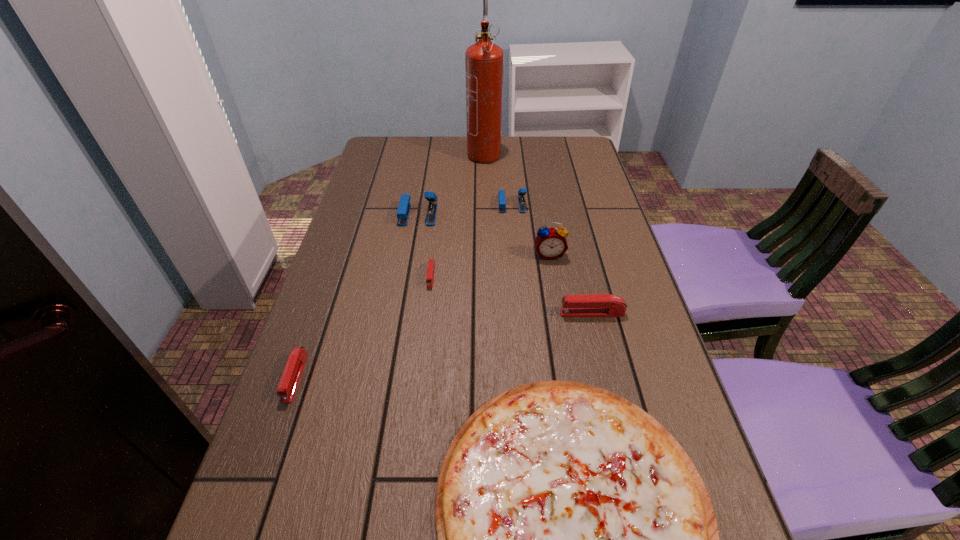
Locate an element on the screen. the sixth tallest object is located at coordinates pos(294,367).

Where is `the leftmost red stapler`? The height and width of the screenshot is (540, 960). the leftmost red stapler is located at coordinates (294, 367).

Where is `the smallest red stapler`? The width and height of the screenshot is (960, 540). the smallest red stapler is located at coordinates (431, 263).

Locate an element on the screen. The height and width of the screenshot is (540, 960). the second red stapler from right to left is located at coordinates (431, 263).

At what (x,y) coordinates should I click in order to perform the action: click on free space located 0.060m from the nozzle of the tallest object. Please return your answer as a coordinate pair (x, y). The image size is (960, 540). Looking at the image, I should click on (484, 177).

You are a GUI agent. You are given a task and a screenshot of the screen. Output one action in this format:
    pyautogui.click(x=<x>, y=<y>)
    Task: Click on the free point located on the front-facing side of the alarm clock
    The image size is (960, 540).
    Given the screenshot: What is the action you would take?
    pyautogui.click(x=562, y=324)

The width and height of the screenshot is (960, 540). I want to click on blank space located on the right of the sixth shortest object, so click(x=467, y=214).

Where is `vacant space situated 0.090m on the right of the second tallest stapler`? vacant space situated 0.090m on the right of the second tallest stapler is located at coordinates (554, 205).

Find the location of `vacant space located 0.070m on the front-facing side of the biggest red stapler`. vacant space located 0.070m on the front-facing side of the biggest red stapler is located at coordinates (531, 313).

Identify the location of vacant space located 0.090m on the front-facing side of the biggest red stapler. [x=522, y=313].